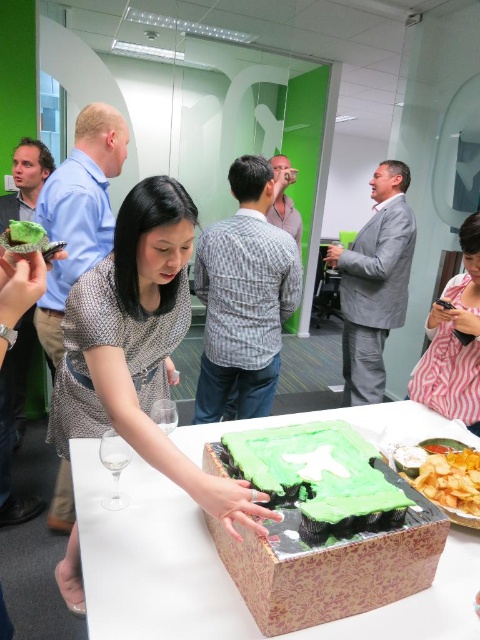
Question: Does green paper cake at center appear on the right side of crunchy golden chips at lower right?

Choices:
 (A) yes
 (B) no

Answer: (B)

Question: Which point is farther from the camera taking this photo?

Choices:
 (A) (475, 492)
 (B) (236, 179)

Answer: (B)

Question: Is green paper cake at center positioned at the back of plaid shirt at center?

Choices:
 (A) yes
 (B) no

Answer: (B)

Question: Which point appears farthest from the camera in this image?

Choices:
 (A) pyautogui.click(x=347, y=356)
 (B) pyautogui.click(x=264, y=400)
 (C) pyautogui.click(x=229, y=435)
 (D) pyautogui.click(x=458, y=388)

Answer: (A)

Question: Based on their relative distances, which object is farther from the pink striped shirt at lower right?

Choices:
 (A) matte green cake at center
 (B) green frosted cake at center

Answer: (A)

Question: Is green paper cake at center to the right of green frosted cake at center from the viewer's perspective?

Choices:
 (A) no
 (B) yes

Answer: (B)